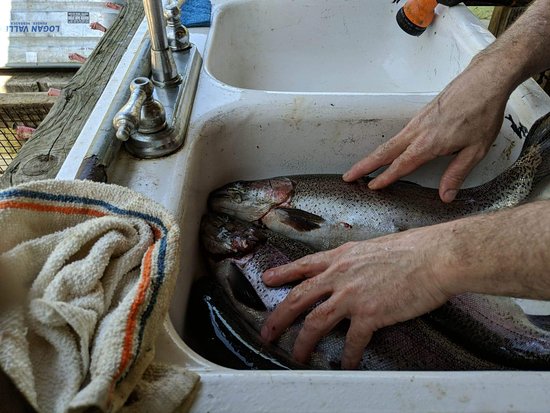
The width and height of the screenshot is (550, 413). Identify the location of faucet. 170,76.